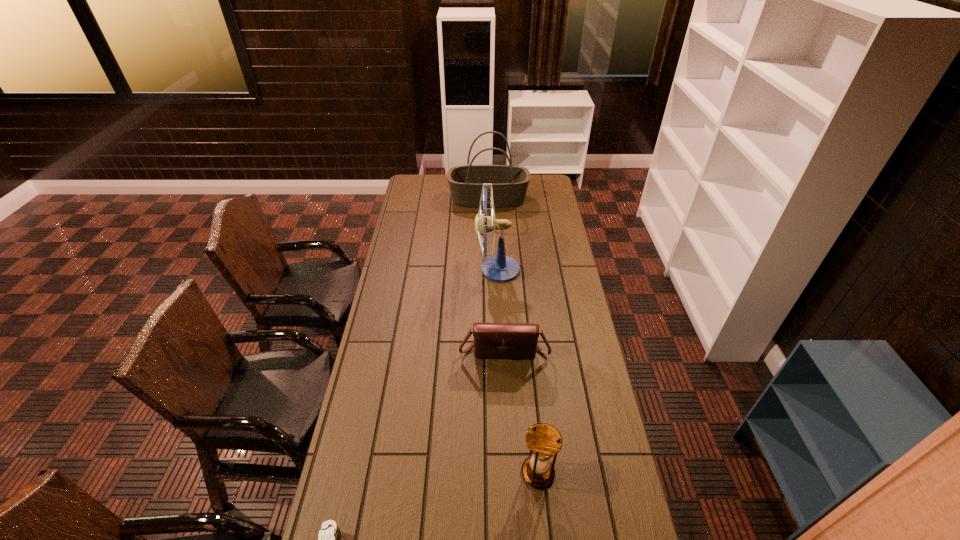
The height and width of the screenshot is (540, 960). What are the coordinates of `vacant region located 0.070m at the front of the fan where the blades are visible` in the screenshot? It's located at (461, 269).

Identify the location of vacant space located 0.260m on the front of the second tallest object. point(490,238).

Where is `vacant space situated on the back of the hourglass`? Image resolution: width=960 pixels, height=540 pixels. vacant space situated on the back of the hourglass is located at coordinates (529, 380).

In order to click on vacant space located 0.120m on the front flap of the third farthest object in this screenshot , I will do `click(506, 389)`.

Find the location of a particular element. The image size is (960, 540). object at the far edge is located at coordinates (509, 183).

Where is `object located at the right edge`? Image resolution: width=960 pixels, height=540 pixels. object located at the right edge is located at coordinates click(x=509, y=183).

The width and height of the screenshot is (960, 540). Find the location of `object present at the far right corner`. object present at the far right corner is located at coordinates (509, 183).

I want to click on blank space at the left edge, so click(405, 296).

Locate an element on the screen. The width and height of the screenshot is (960, 540). vacant space at the right edge of the desktop is located at coordinates (568, 275).

You are a GUI agent. You are given a task and a screenshot of the screen. Output one action in this format:
    pyautogui.click(x=<x>, y=<y>)
    Task: Click on the vacant area at the far left corner
    
    Given the screenshot: What is the action you would take?
    pyautogui.click(x=423, y=186)